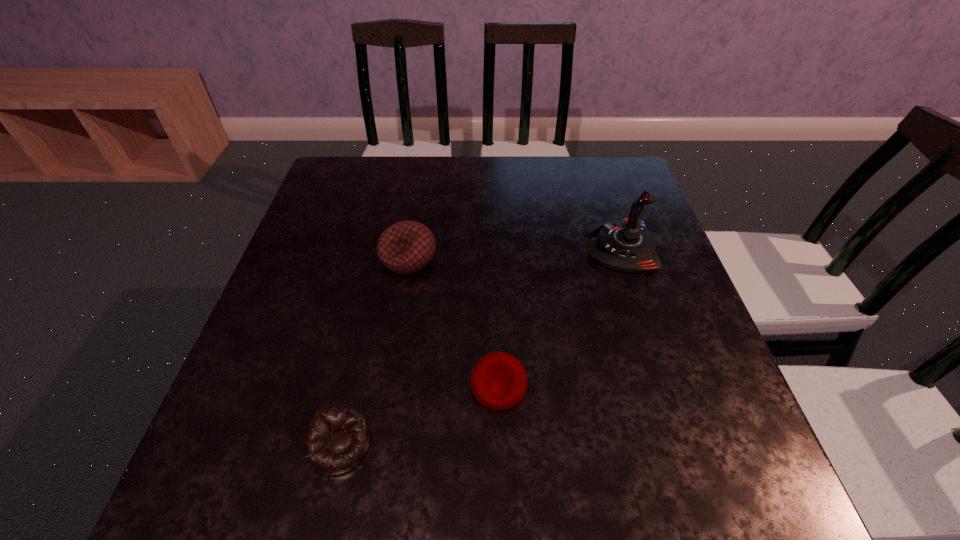
Image resolution: width=960 pixels, height=540 pixels. What are the coordinates of `free point between the nearest object and the second farthest beanbag` in the screenshot? It's located at (420, 415).

Identify the location of vacant space in between the third farthest object and the tallest beanbag. The height and width of the screenshot is (540, 960). (453, 321).

At what (x,y) coordinates should I click in order to perform the action: click on object identified as the closest to the tallest object. Please return your answer as a coordinate pair (x, y). The image size is (960, 540). Looking at the image, I should click on pos(499,381).

Point out which object is positioned as the third nearest to the second shortest object. Please provide its 2D coordinates. Your answer should be formatted as a tuple, i.e. [(x, y)], where the tuple contains the x and y coordinates of a point satisfying the conditions above.

[(625, 244)]

Identify which beanbag is located as the nearest to the shortest beanbag. Please provide its 2D coordinates. Your answer should be formatted as a tuple, i.e. [(x, y)], where the tuple contains the x and y coordinates of a point satisfying the conditions above.

[(499, 381)]

Point out which beanbag is positioned as the nearest to the tallest beanbag. Please provide its 2D coordinates. Your answer should be formatted as a tuple, i.e. [(x, y)], where the tuple contains the x and y coordinates of a point satisfying the conditions above.

[(499, 381)]

Image resolution: width=960 pixels, height=540 pixels. What are the coordinates of `blank space that satisfies the following two spatial constraints: 1. on the back side of the nearest object; 2. on the left side of the tallest beanbag` in the screenshot? It's located at (382, 257).

Identify the location of free location that satisfies the following two spatial constraints: 1. on the handle side of the rightmost object; 2. on the seat area of the third tallest object. The image size is (960, 540). (666, 385).